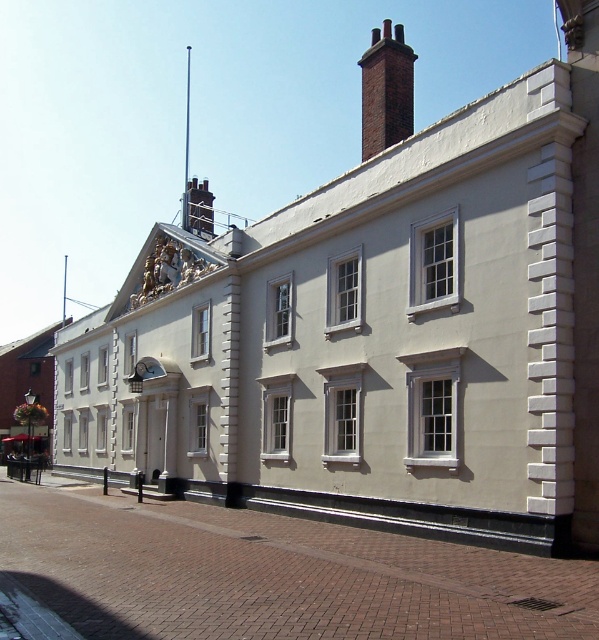
Question: Can you confirm if brick chimney at upper center is bigger than metallic clock at center?

Choices:
 (A) yes
 (B) no

Answer: (A)

Question: Which point is farther from the camera taking this photo?

Choices:
 (A) (397, 99)
 (B) (138, 364)

Answer: (B)

Question: Does brick chimney at upper center appear over metallic clock at center?

Choices:
 (A) yes
 (B) no

Answer: (A)

Question: Does brick chimney at upper center have a smaller size compared to metallic clock at center?

Choices:
 (A) no
 (B) yes

Answer: (A)